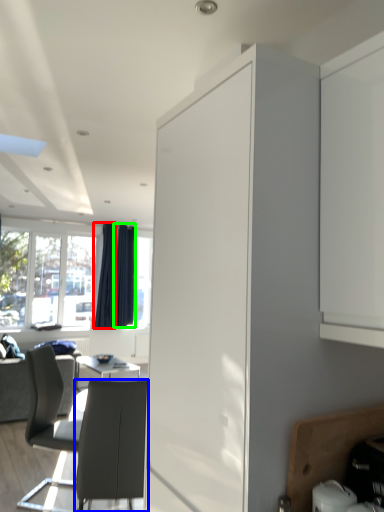
Question: Which object is positioned farthest from curtain (highlighted by a red box)? Select from chair (highlighted by a blue box) and curtain (highlighted by a green box).

Choices:
 (A) chair
 (B) curtain

Answer: (A)